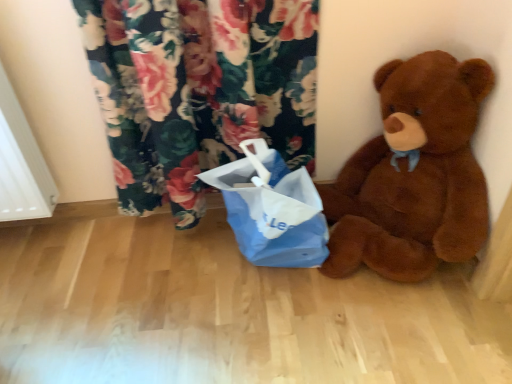
Question: Is brown plush teddy bear at right looking in the opposite direction of blue paper bag at center?

Choices:
 (A) yes
 (B) no

Answer: (B)

Question: Is brown plush teddy bear at right wider than blue paper bag at center?

Choices:
 (A) no
 (B) yes

Answer: (B)

Question: Is brown plush teddy bear at right facing towards blue paper bag at center?

Choices:
 (A) no
 (B) yes

Answer: (A)

Question: From a real-world perspective, is brown plush teddy bear at right physically above blue paper bag at center?

Choices:
 (A) no
 (B) yes

Answer: (B)

Question: Is brown plush teddy bear at right far from blue paper bag at center?

Choices:
 (A) no
 (B) yes

Answer: (A)

Question: From the image's perspective, is brown plush teddy bear at right on blue paper bag at center?

Choices:
 (A) yes
 (B) no

Answer: (A)

Question: From the image's perspective, would you say blue paper bag at center is positioned over brown plush teddy bear at right?

Choices:
 (A) no
 (B) yes

Answer: (A)

Question: Does blue paper bag at center have a greater height compared to brown plush teddy bear at right?

Choices:
 (A) yes
 (B) no

Answer: (B)

Question: Considering the relative sizes of blue paper bag at center and brown plush teddy bear at right in the image provided, is blue paper bag at center thinner than brown plush teddy bear at right?

Choices:
 (A) no
 (B) yes

Answer: (B)

Question: Considering the relative positions of blue paper bag at center and brown plush teddy bear at right in the image provided, is blue paper bag at center to the left of brown plush teddy bear at right from the viewer's perspective?

Choices:
 (A) yes
 (B) no

Answer: (A)

Question: From the image's perspective, is blue paper bag at center beneath brown plush teddy bear at right?

Choices:
 (A) yes
 (B) no

Answer: (A)

Question: Can you confirm if blue paper bag at center is shorter than brown plush teddy bear at right?

Choices:
 (A) yes
 (B) no

Answer: (A)

Question: Considering the positions of blue paper bag at center and brown plush teddy bear at right in the image, is blue paper bag at center taller or shorter than brown plush teddy bear at right?

Choices:
 (A) short
 (B) tall

Answer: (A)